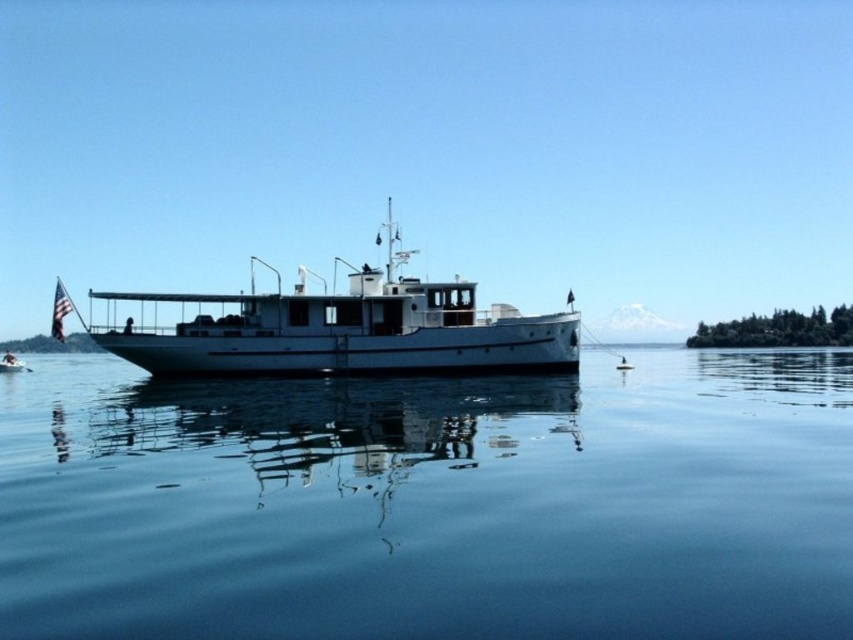
You are a sailor trying to navigate a small inflatable boat that is 3 meters long. You see the white glossy boat at left and the transparent blue water at center. Can your boat safely pass between them without touching either?

The distance between the transparent blue water at center and the white glossy boat at left is 47.52 meters, which is greater than the length of your 3 meter boat. Therefore, your boat can safely pass between them without touching either.